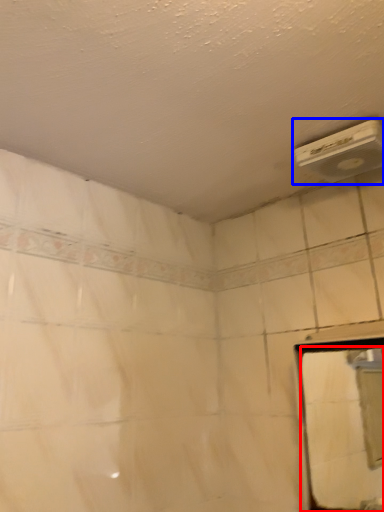
Question: Which point is closer to the camera, mirror (highlighted by a red box) or air conditioning (highlighted by a blue box)?

Choices:
 (A) mirror
 (B) air conditioning

Answer: (A)